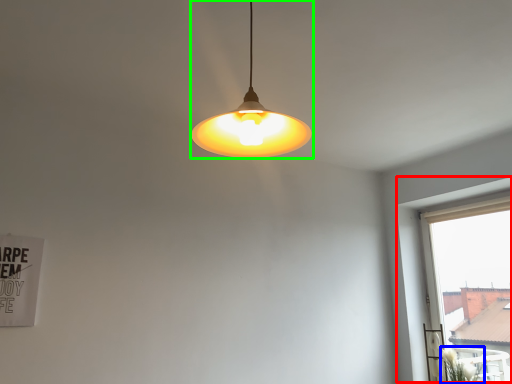
Question: Based on their relative distances, which object is nearer to window (highlighted by a red box)? Choose from plant (highlighted by a blue box) and lamp (highlighted by a green box).

Choices:
 (A) plant
 (B) lamp

Answer: (A)